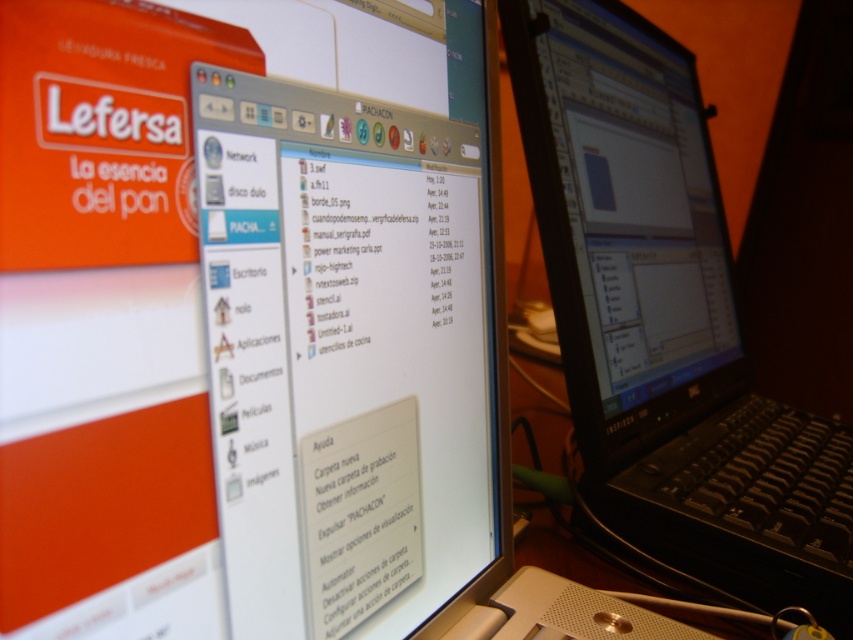
You are setting up a new workspace and need to place the black plastic laptop at center and the matte black monitor at center on a desk. According to the image, which object should be placed to the left side of the desk to ensure proper alignment with the existing setup?

The matte black monitor at center should be placed to the left side of the desk because in the image, the black plastic laptop at center is to the right of the matte black monitor at center, indicating that the monitor is positioned to the left of the laptop.

What object is located at the coordinates point (666, 320) in the computer setup?

The point (666, 320) corresponds to the black plastic laptop at center.

You are setting up a new desk and want to place the black plastic laptop at center and the matte black monitor at center on your desk. Considering their heights, which object should you place first to ensure stability?

The black plastic laptop at center has a greater height compared to the matte black monitor at center. To ensure stability, you should place the black plastic laptop at center first as it is taller and can provide a stable base for the monitor.